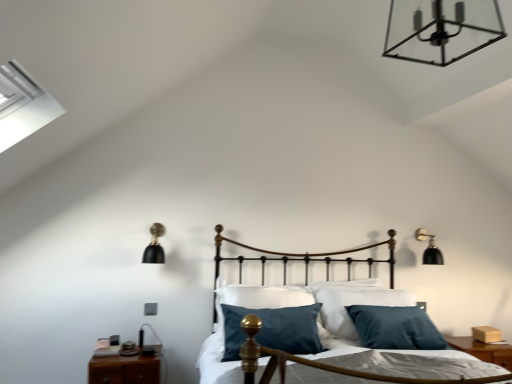
Question: Should I look upward or downward to see black matte wall sconce at right, the 1th lamp in the back-to-front sequence?

Choices:
 (A) up
 (B) down

Answer: (B)

Question: From a real-world perspective, is metal/transparent glass chandelier at upper center, the 3th lamp positioned from the bottom, located beneath brown wood nightstand at lower left, positioned as the 2th nightstand in back-to-front order?

Choices:
 (A) no
 (B) yes

Answer: (A)

Question: Considering the relative sizes of metal/transparent glass chandelier at upper center, which appears as the first lamp when viewed from the front, and brown wood nightstand at lower left, which ranks as the first nightstand in front-to-back order, in the image provided, is metal/transparent glass chandelier at upper center, which appears as the first lamp when viewed from the front, wider than brown wood nightstand at lower left, which ranks as the first nightstand in front-to-back order,?

Choices:
 (A) yes
 (B) no

Answer: (A)

Question: Does metal/transparent glass chandelier at upper center, the second lamp viewed from the left, come in front of brown wood nightstand at lower left, which ranks as the first nightstand in front-to-back order?

Choices:
 (A) no
 (B) yes

Answer: (B)

Question: From the image's perspective, is metal/transparent glass chandelier at upper center, the second lamp viewed from the left, below brown wood nightstand at lower left, positioned as the 1th nightstand in left-to-right order?

Choices:
 (A) yes
 (B) no

Answer: (B)

Question: Considering the relative positions of metal/transparent glass chandelier at upper center, which appears as the first lamp when viewed from the front, and brown wood nightstand at lower left, which ranks as the first nightstand in front-to-back order, in the image provided, is metal/transparent glass chandelier at upper center, which appears as the first lamp when viewed from the front, behind brown wood nightstand at lower left, which ranks as the first nightstand in front-to-back order,?

Choices:
 (A) yes
 (B) no

Answer: (B)

Question: Is metal/transparent glass chandelier at upper center, the 2th lamp viewed from the right, taller than brown wood nightstand at lower left, the second nightstand positioned from the right?

Choices:
 (A) no
 (B) yes

Answer: (B)

Question: Is gold polished metal bed frame at center facing towards brown wood nightstand at lower left, positioned as the 1th nightstand in left-to-right order?

Choices:
 (A) no
 (B) yes

Answer: (A)

Question: Can you confirm if gold polished metal bed frame at center is positioned to the left of brown wood nightstand at lower left, which ranks as the first nightstand in front-to-back order?

Choices:
 (A) no
 (B) yes

Answer: (A)

Question: Does gold polished metal bed frame at center have a greater height compared to brown wood nightstand at lower left, the second nightstand positioned from the right?

Choices:
 (A) yes
 (B) no

Answer: (A)

Question: Considering the relative positions of gold polished metal bed frame at center and brown wood nightstand at lower left, positioned as the 2th nightstand in back-to-front order, in the image provided, is gold polished metal bed frame at center behind brown wood nightstand at lower left, positioned as the 2th nightstand in back-to-front order,?

Choices:
 (A) yes
 (B) no

Answer: (B)

Question: Considering the relative sizes of gold polished metal bed frame at center and brown wood nightstand at lower left, the second nightstand positioned from the right, in the image provided, is gold polished metal bed frame at center thinner than brown wood nightstand at lower left, the second nightstand positioned from the right,?

Choices:
 (A) no
 (B) yes

Answer: (A)

Question: Can you confirm if gold polished metal bed frame at center is smaller than brown wood nightstand at lower left, positioned as the 1th nightstand in left-to-right order?

Choices:
 (A) no
 (B) yes

Answer: (A)

Question: Is brown wood nightstand at lower left, which ranks as the first nightstand in front-to-back order, at the left side of black matte wall sconce at left, the second lamp when ordered from top to bottom?

Choices:
 (A) no
 (B) yes

Answer: (B)